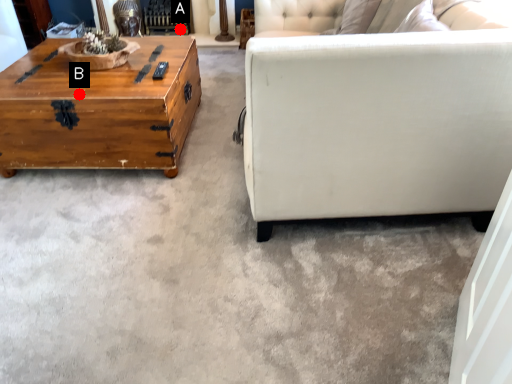
Question: Two points are circled on the image, labeled by A and B beside each circle. Which point is closer to the camera?

Choices:
 (A) A is closer
 (B) B is closer

Answer: (B)